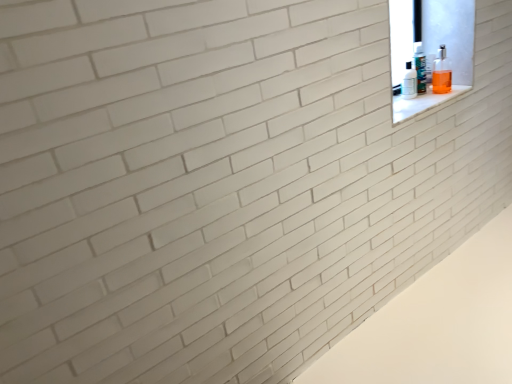
Consider the image. Measure the distance between white matte wall at lower right and camera.

A distance of 1.38 meters exists between white matte wall at lower right and camera.

At what (x,y) coordinates should I click in order to perform the action: click on white matte wall at lower right. Please return your answer as a coordinate pair (x, y). Looking at the image, I should click on (437, 323).

What do you see at coordinates (437, 323) in the screenshot? I see `white matte wall at lower right` at bounding box center [437, 323].

What are the coordinates of `white matte wall at lower right` in the screenshot? It's located at (437, 323).